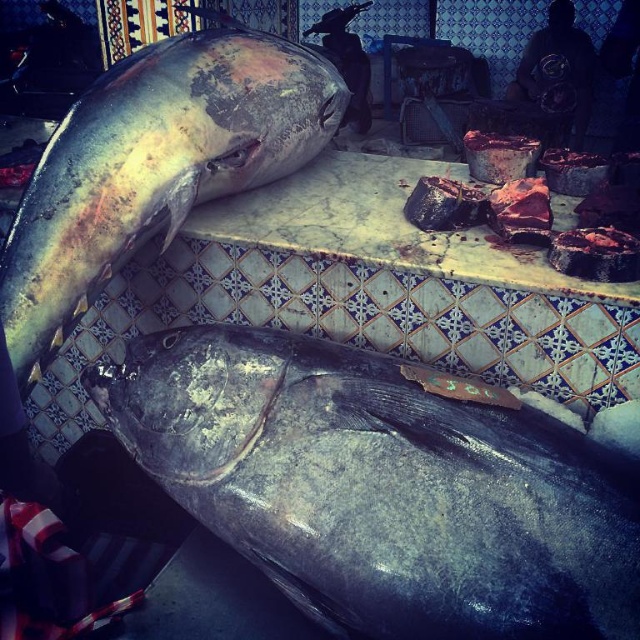
You are a customer at the fish market and want to buy the larger tuna. Which fish should you choose between the shiny dark gray fish at center and the shiny silver fish at center?

The shiny silver fish at center is larger because it is longer than the shiny dark gray fish at center according to their descriptions.

You are a fishmonger who needs to fit both the shiny dark gray fish at center and the shiny silver fish at center into a refrigerated display case that is 1.2 meters wide. The case must have at least 10 cm of space between the fish and the sides of the case. Can both fish fit side by side in the case?

The shiny dark gray fish at center is wider than the shiny silver fish at center. To determine if both can fit, first calculate the minimum required space. The case needs 10 cm on each side, totaling 20 cm. Subtract this from 1.2 meters, leaving 1.0 meters. Since the shiny dark gray fish is wider, if its width plus the silver fish width is less than or equal to 1.0 meters, they can fit. However, without exact measurements, we cannot confirm. The description only states the dark gray fish is wider, but notby